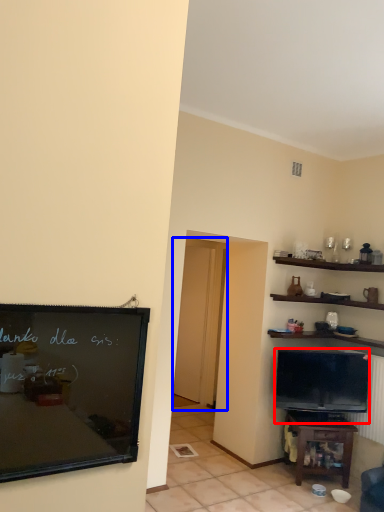
Question: Which point is further to the camera, television (highlighted by a red box) or glass door (highlighted by a blue box)?

Choices:
 (A) television
 (B) glass door

Answer: (B)